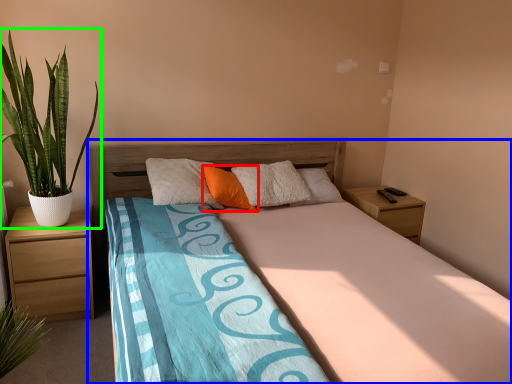
Question: Which object is the closest to the pillow (highlighted by a red box)? Choose among these: bed (highlighted by a blue box) or houseplant (highlighted by a green box).

Choices:
 (A) bed
 (B) houseplant

Answer: (A)